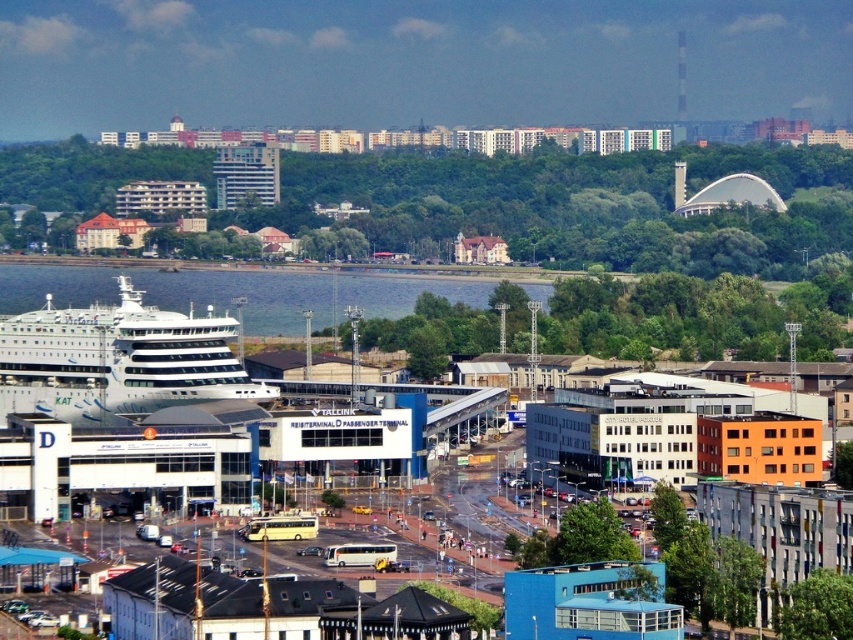
Which is more to the right, white glossy cruise ship at left or clear blue water at center?

clear blue water at center is more to the right.

Does white glossy cruise ship at left have a smaller size compared to clear blue water at center?

Correct, white glossy cruise ship at left occupies less space than clear blue water at center.

Is point (155, 333) less distant than point (265, 296)?

No.

Where is `white glossy cruise ship at left`? white glossy cruise ship at left is located at coordinates (117, 360).